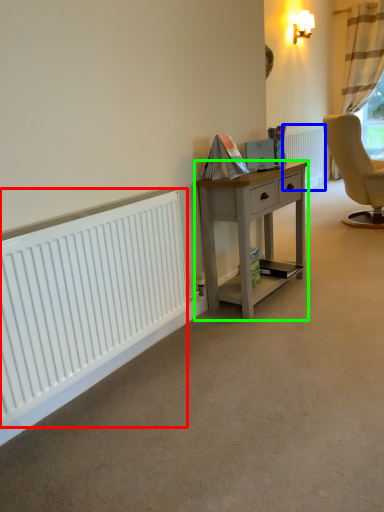
Question: Which object is the farthest from radiator (highlighted by a red box)? Choose among these: radiator (highlighted by a blue box) or desk (highlighted by a green box).

Choices:
 (A) radiator
 (B) desk

Answer: (A)